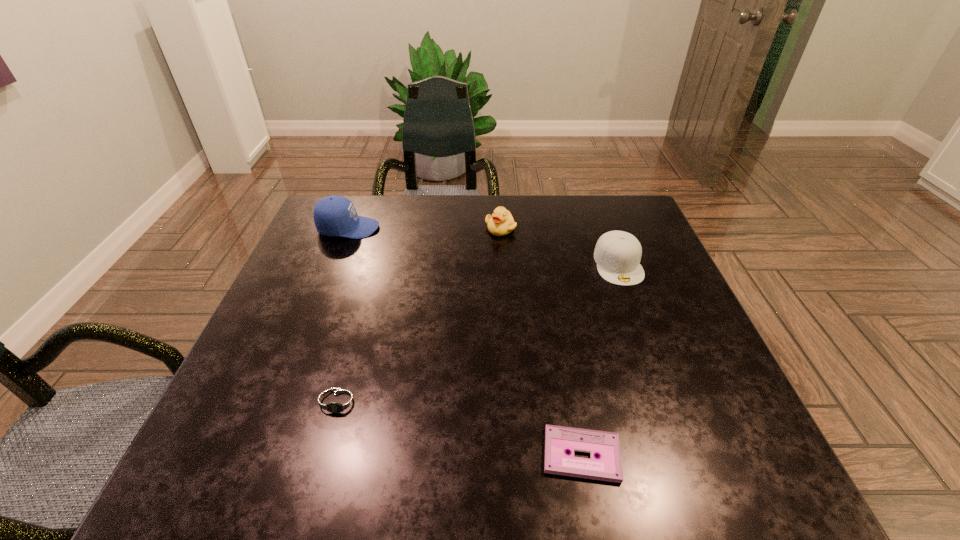
In the image, there is a desktop. In order to click on vacant space at the far edge in this screenshot , I will do `click(549, 207)`.

Find the location of a particular element. The width and height of the screenshot is (960, 540). vacant space at the near edge of the desktop is located at coordinates (460, 476).

This screenshot has width=960, height=540. Find the location of `vacant space at the left edge of the desktop`. vacant space at the left edge of the desktop is located at coordinates (300, 396).

The image size is (960, 540). What are the coordinates of `blank space at the right edge of the desktop` in the screenshot? It's located at (670, 294).

Image resolution: width=960 pixels, height=540 pixels. I want to click on vacant region at the far left corner of the desktop, so click(x=316, y=240).

Image resolution: width=960 pixels, height=540 pixels. In the image, there is a desktop. Identify the location of vacant space at the near left corner. (252, 449).

Where is `vacant space at the far right corner of the desktop`? This screenshot has width=960, height=540. vacant space at the far right corner of the desktop is located at coordinates (604, 199).

Where is `vacant space at the near right corner of the desktop`? Image resolution: width=960 pixels, height=540 pixels. vacant space at the near right corner of the desktop is located at coordinates (778, 485).

Identify the location of unoccupied position between the third object from left to right and the watch. (420, 315).

This screenshot has height=540, width=960. Find the location of `vacant region between the farther cap and the fourth object from left to right`. vacant region between the farther cap and the fourth object from left to right is located at coordinates (465, 341).